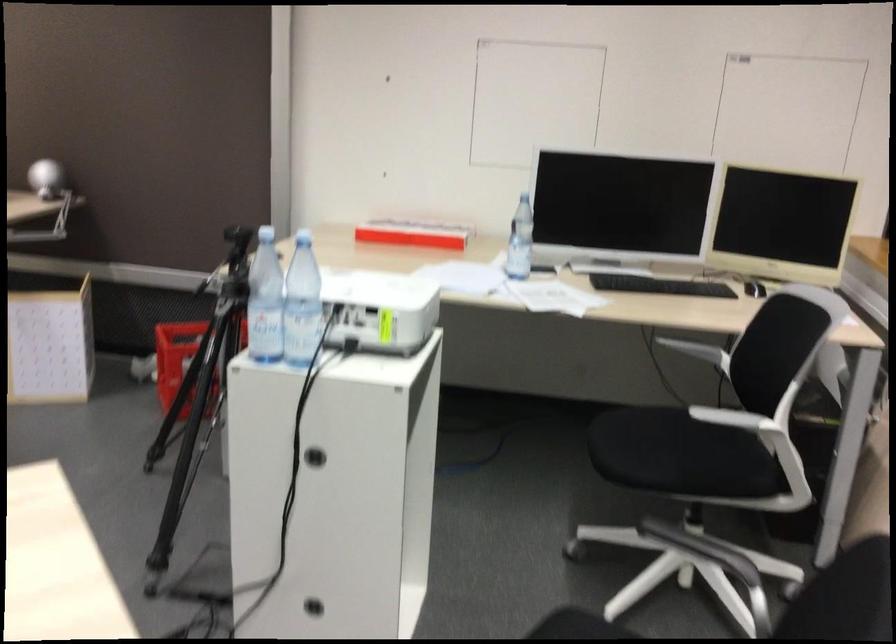
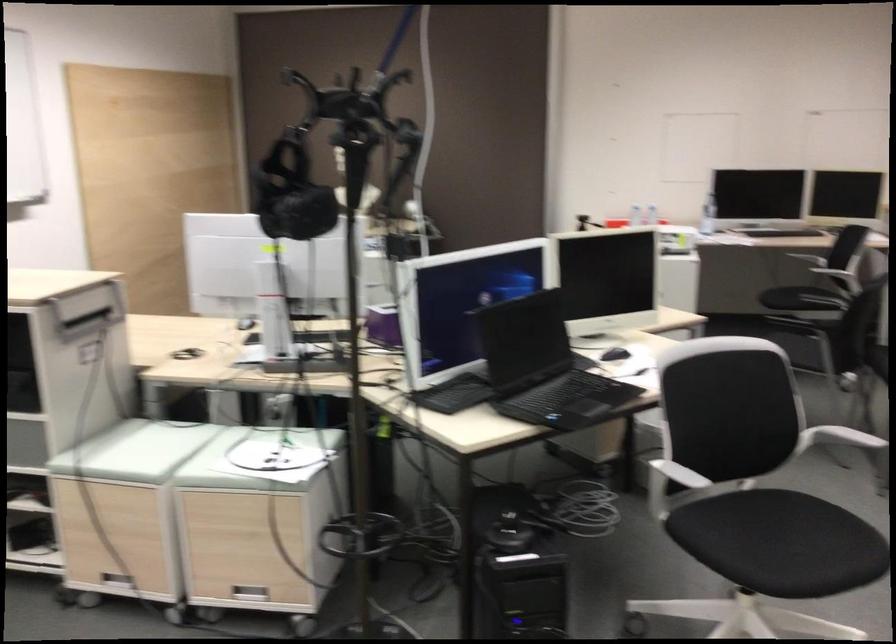
Question: I am providing you with two images of the same scene from different viewpoints. Please identify which objects are invisible in image2.

Choices:
 (A) metal drawer handle
 (B) black computer mouse
 (C) wooden cabinet lid
 (D) plastic water bottle

Answer: (D)